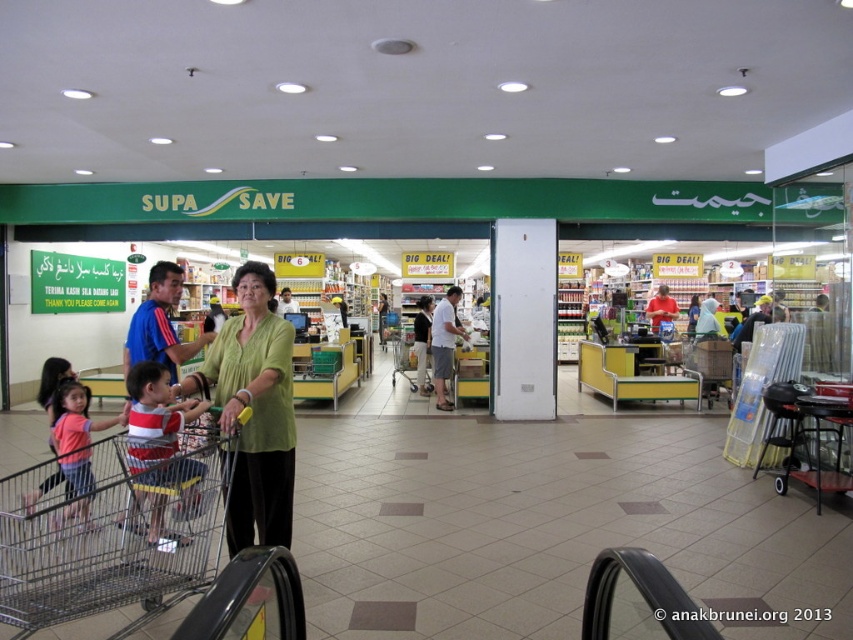
You are a customer at Supa Save supermarket and you want to buy a pink matte shirt. You see the pink matte shirt at lower left and the white cotton shirt at center. Which shirt is closer to the floor?

The pink matte shirt at lower left is positioned under the white cotton shirt at center, so it is closer to the floor.